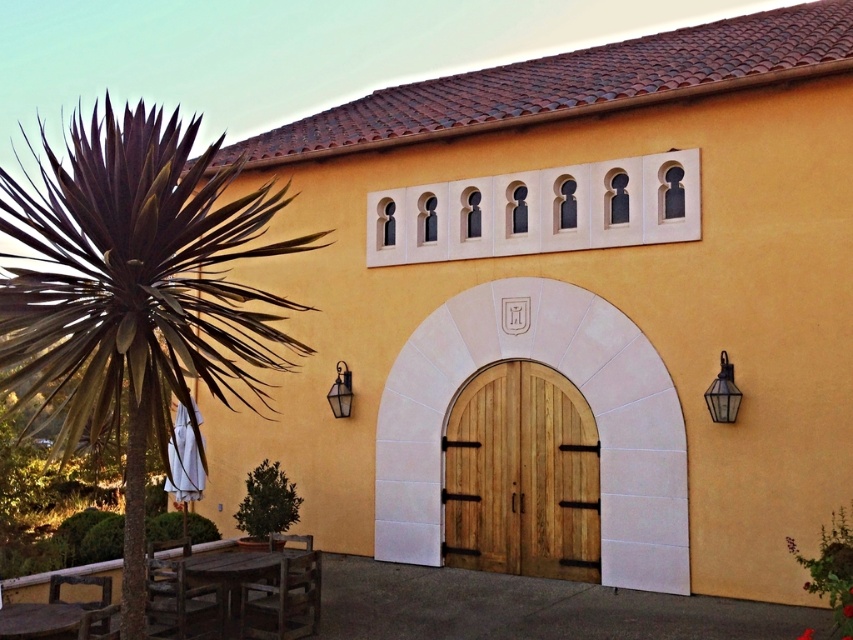
In the scene shown: Can you confirm if purple-leaved palm at left is positioned to the right of wooden door at center?

In fact, purple-leaved palm at left is to the left of wooden door at center.

Who is shorter, purple-leaved palm at left or wooden door at center?

Standing shorter between the two is wooden door at center.

Who is more distant from viewer, (131, 289) or (579, 406)?

Point (579, 406)

Identify the location of purple-leaved palm at left. click(135, 296).